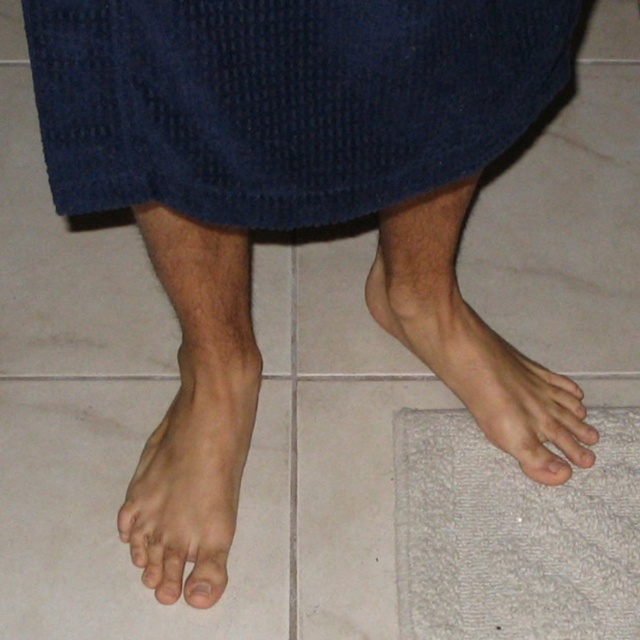
Which is more to the left, skinny white foot at lower left or smooth skin foot at lower right?

Positioned to the left is skinny white foot at lower left.

This screenshot has width=640, height=640. What do you see at coordinates (115, 513) in the screenshot?
I see `skinny white foot at lower left` at bounding box center [115, 513].

Is point (54, 417) farther from camera compared to point (545, 412)?

That is True.

Find the location of a particular element. skinny white foot at lower left is located at coordinates (115, 513).

Identify the location of white textured bath mat at lower right. This screenshot has height=640, width=640. (513, 536).

Who is shorter, white textured bath mat at lower right or smooth skin toe at lower left?

smooth skin toe at lower left

Between point (410, 480) and point (186, 586), which one is positioned behind?

The point (410, 480) is behind.

You are a GUI agent. You are given a task and a screenshot of the screen. Output one action in this format:
    pyautogui.click(x=<x>, y=<y>)
    Task: Click on the white textured bath mat at lower right
    This screenshot has height=640, width=640.
    Given the screenshot: What is the action you would take?
    pyautogui.click(x=513, y=536)

Does smooth skin foot at lower right have a greater width compared to smooth skin toe at lower left?

Yes, smooth skin foot at lower right is wider than smooth skin toe at lower left.

Between smooth skin foot at lower right and smooth skin toe at lower left, which one is positioned lower?

smooth skin toe at lower left is lower down.

This screenshot has width=640, height=640. Find the location of `smooth skin foot at lower right`. smooth skin foot at lower right is located at coordinates (477, 358).

This screenshot has width=640, height=640. Identify the location of smooth skin foot at lower right. (477, 358).